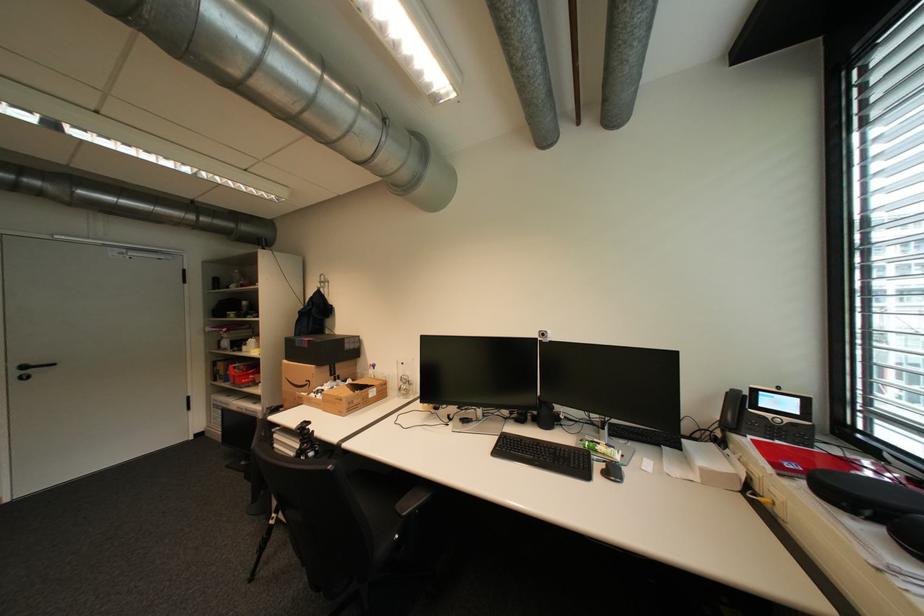
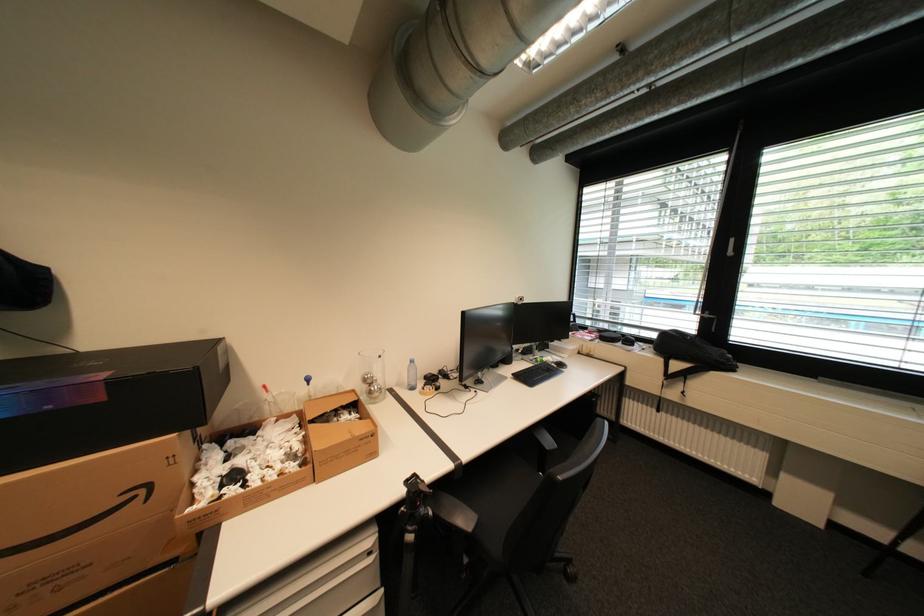
Find the pixel in the second image that matches [345,399] in the first image.

(370, 440)